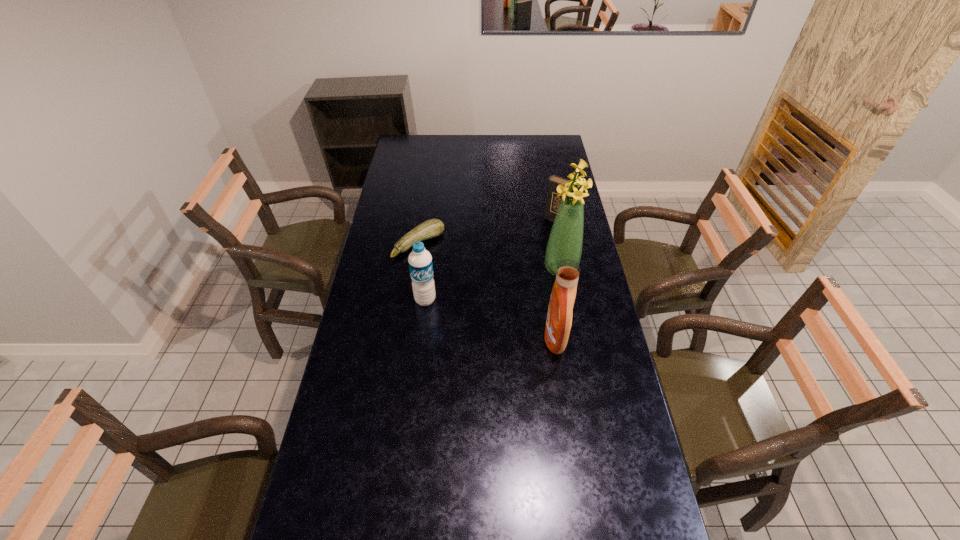
This screenshot has height=540, width=960. I want to click on vacant space on the desktop that is between the water bottle and the second tallest object and is positioned at the stem end of the zucchini, so click(504, 323).

Locate an element on the screen. free space on the desktop that is between the second nearest object and the second tallest object and is positioned on the front-facing side of the tallest object is located at coordinates (486, 318).

The width and height of the screenshot is (960, 540). What are the coordinates of `free spot on the desktop that is between the third tallest object and the fourth shortest object and is positioned on the front cover of the fourth tallest object` in the screenshot? It's located at (474, 314).